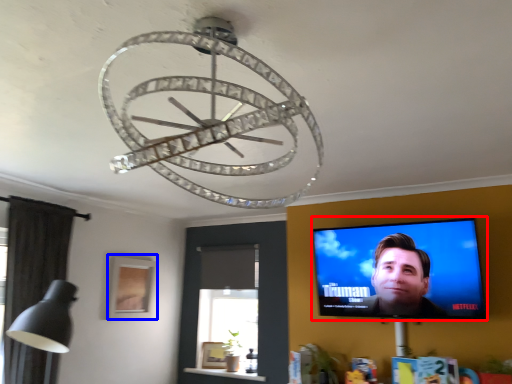
Question: Which object is further to the camera taking this photo, computer screen (highlighted by a red box) or picture frame (highlighted by a blue box)?

Choices:
 (A) computer screen
 (B) picture frame

Answer: (B)